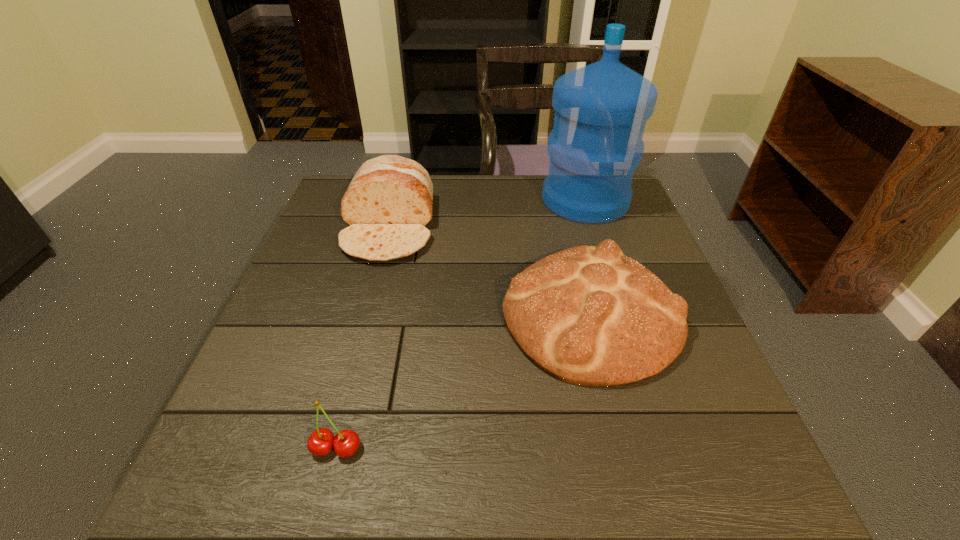
The height and width of the screenshot is (540, 960). What are the coordinates of `water jug` in the screenshot? It's located at click(x=601, y=110).

This screenshot has height=540, width=960. What are the coordinates of `the left bread` in the screenshot? It's located at (388, 203).

Locate an element on the screen. the right bread is located at coordinates (588, 315).

Identify the location of cherry. This screenshot has height=540, width=960. (346, 442).

You are a GUI agent. You are given a task and a screenshot of the screen. Output one action in this format:
    pyautogui.click(x=<x>, y=<y>)
    Task: Click on the nearest object
    
    Given the screenshot: What is the action you would take?
    pyautogui.click(x=346, y=442)

Find the location of a particular element. The image size is (960, 540). vacant area situated on the left of the tallest object is located at coordinates (476, 200).

The width and height of the screenshot is (960, 540). Identify the location of free space located at the sliced end of the left bread. (342, 409).

What are the coordinates of `free location located on the front of the right bread` in the screenshot? It's located at (637, 510).

The image size is (960, 540). Find the location of `free spot located 0.070m with the stems of the cherry pointing upwards`. free spot located 0.070m with the stems of the cherry pointing upwards is located at coordinates (323, 506).

The image size is (960, 540). I want to click on water jug that is at the far edge, so click(x=601, y=110).